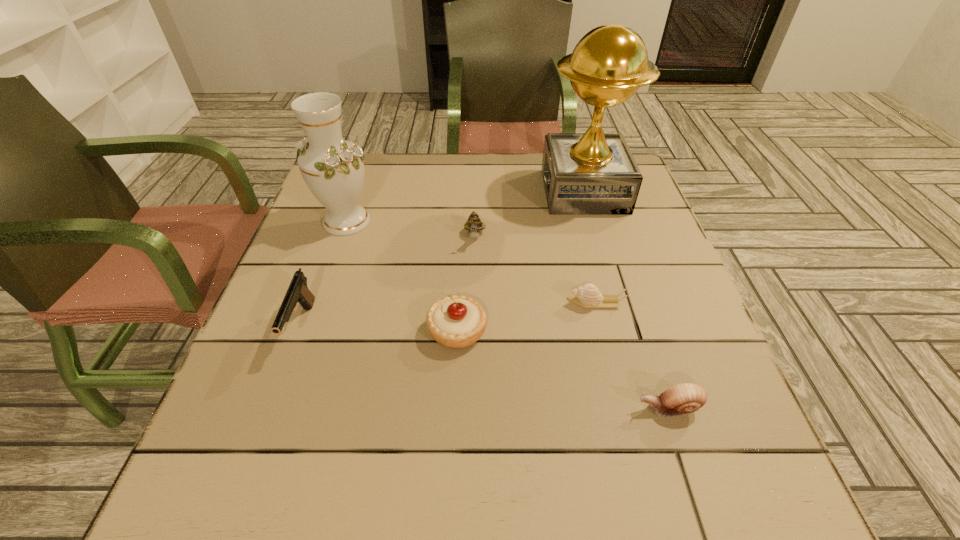
The image size is (960, 540). What are the coordinates of `the tallest object` in the screenshot? It's located at (594, 173).

What are the coordinates of `the sixth shortest object` in the screenshot? It's located at (333, 169).

Where is `the tallest escargot`? the tallest escargot is located at coordinates (473, 225).

At what (x,y) coordinates should I click in order to perform the action: click on the farthest escargot. Please return your answer as a coordinate pair (x, y). Looking at the image, I should click on (473, 225).

Identify the location of pistol. (298, 292).

The image size is (960, 540). In order to click on pastry in this screenshot , I will do `click(456, 322)`.

Find the location of `the nearest escargot`. the nearest escargot is located at coordinates click(x=684, y=398).

The image size is (960, 540). I want to click on the nearest object, so click(684, 398).

The height and width of the screenshot is (540, 960). Identify the location of the second nearest escargot. (587, 295).

You are a GUI agent. You are given a task and a screenshot of the screen. Output one action in this format:
    pyautogui.click(x=<x>, y=<y>)
    Task: Click on the shortest object
    
    Given the screenshot: What is the action you would take?
    pyautogui.click(x=587, y=295)